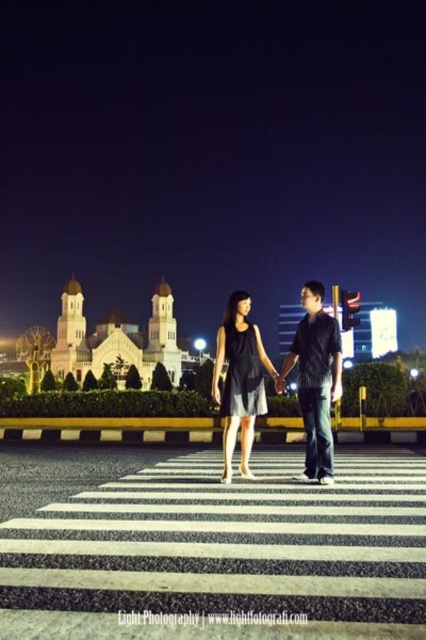
You are a photographer trying to capture the couple in the center of the pedestrian crossing. You want to ensure that both the dark blue jeans at center and the matte black dress at center are clearly visible in your photo. Based on their positions, which clothing item is closer to the right edge of the frame?

The dark blue jeans at center is positioned on the right side of matte black dress at center, so the dark blue jeans at center is closer to the right edge of the frame.

You are a photographer standing at the edge of the crosswalk. You want to take a photo of the dark blue jeans at center. Where should you aim your camera to capture the jeans in the frame?

Aim your camera at the point 0.594 on the horizontal axis and 0.742 on the vertical axis to capture the dark blue jeans at center.

You are a photographer trying to capture the couple in the center of the crosswalk. Since the dark blue jeans at center and the matte black dress at center are both in focus, can you determine which clothing item appears narrower in the photo?

The dark blue jeans at center appears narrower than the matte black dress at center in the photo.